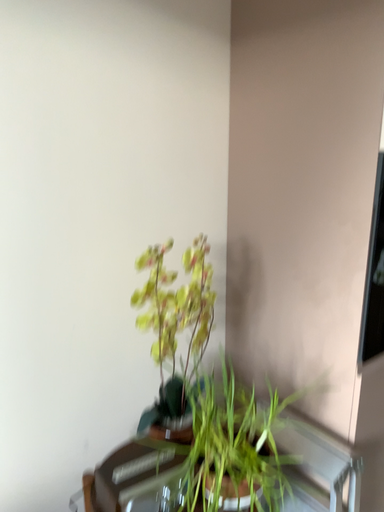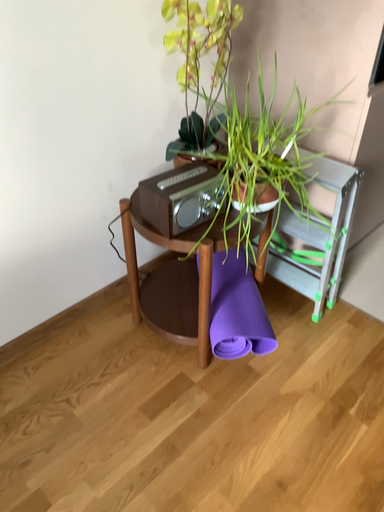
Question: How did the camera likely rotate when shooting the video?

Choices:
 (A) rotated upward
 (B) rotated downward

Answer: (B)